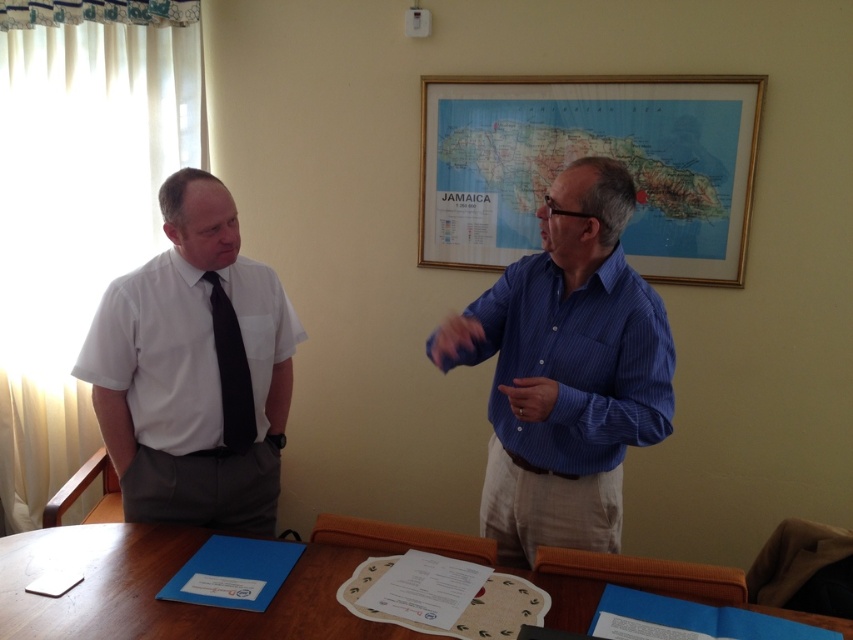
You are a delivery person who needs to place a 16 inch long package on the wooden table at lower center. The black silk tie at left is hanging from the back of a chair. Can the package fit on the table without touching the tie?

The wooden table at lower center is 16.16 inches away from the black silk tie at left. Since the package is 16 inches long, it can fit on the table without touching the tie as there is enough space between them.

You are a delivery person who needs to place a package on the wooden table at lower center. However, there is a black silk tie at left nearby. Which object should you avoid placing the package on?

You should avoid placing the package on the black silk tie at left because the wooden table at lower center is the correct surface for placing items, and the black silk tie at left is likely worn by a person and not meant for holding packages.

From the picture: You are a delivery person who needs to place a package on the wooden table at lower center. The package is 1 meter tall. Can you safely place it there without it hitting the blue striped shirt at center?

The blue striped shirt at center is above the wooden table at lower center. Since the package is 1 meter tall, it may hit the blue striped shirt at center if placed on the table. Therefore, it is not safe to place the package there.